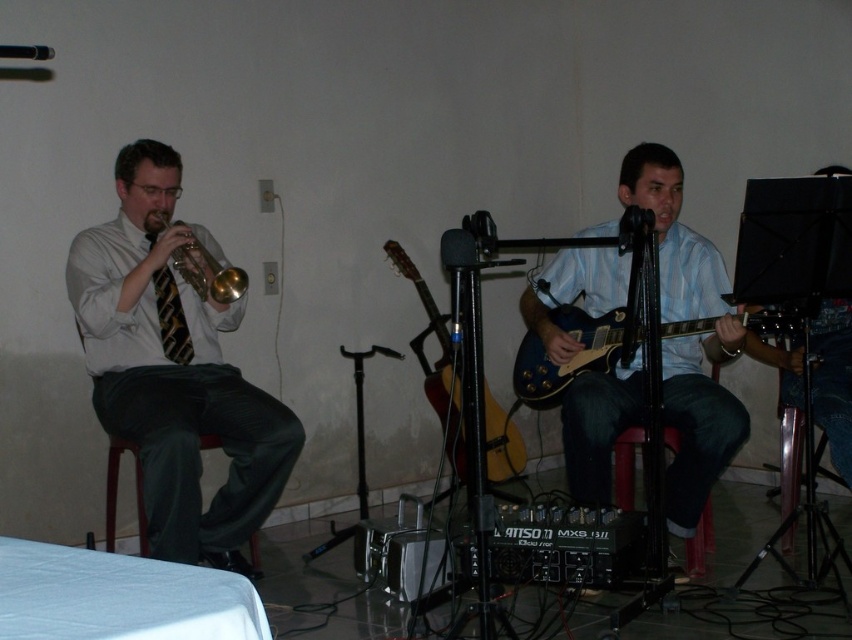
Question: Considering the real-world distances, which object is farthest from the shiny gold trumpet at left?

Choices:
 (A) striped fabric tie at left
 (B) matte blue guitar at center
 (C) blue glossy electric guitar at center
 (D) glossy wood guitar at center

Answer: (B)

Question: Among these objects, which one is farthest from the camera?

Choices:
 (A) brown wooden chair at left
 (B) glossy wood guitar at center
 (C) striped fabric tie at left

Answer: (C)

Question: Is shiny gold trumpet at left thinner than striped fabric tie at left?

Choices:
 (A) no
 (B) yes

Answer: (A)

Question: Can you confirm if shiny gold trumpet at left is bigger than striped fabric tie at left?

Choices:
 (A) yes
 (B) no

Answer: (A)

Question: Estimate the real-world distances between objects in this image. Which object is farther from the shiny gold trumpet at left?

Choices:
 (A) striped fabric tie at left
 (B) brown wooden chair at left

Answer: (B)

Question: Is shiny gold trumpet at left to the right of gold shiny trumpet at left from the viewer's perspective?

Choices:
 (A) yes
 (B) no

Answer: (B)